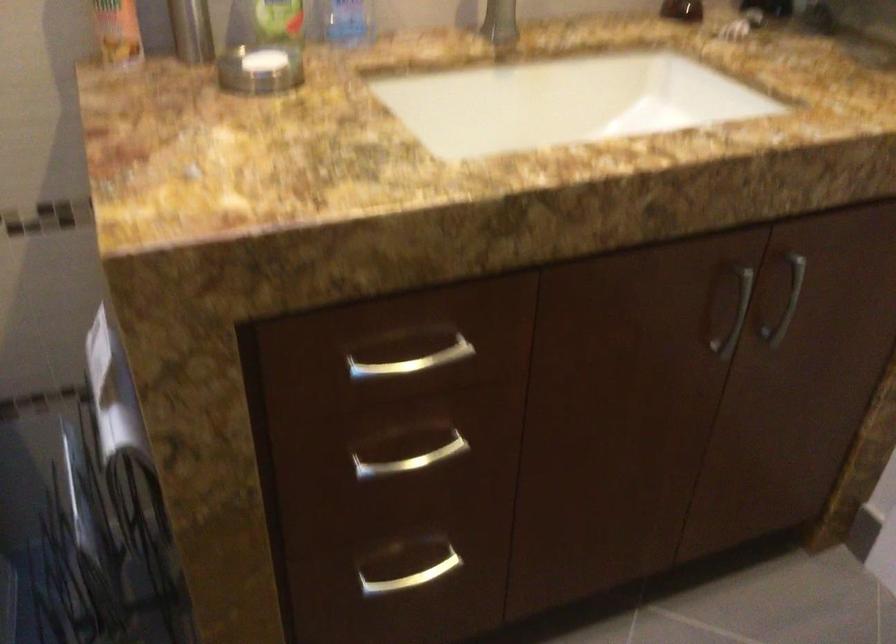
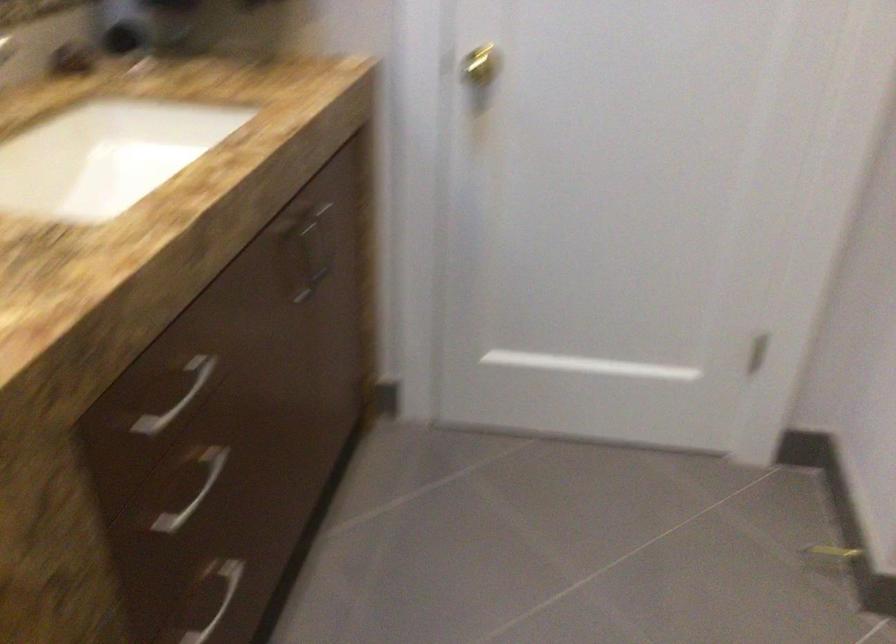
The point at (426, 363) is marked in the first image. Where is the corresponding point in the second image?

(177, 397)